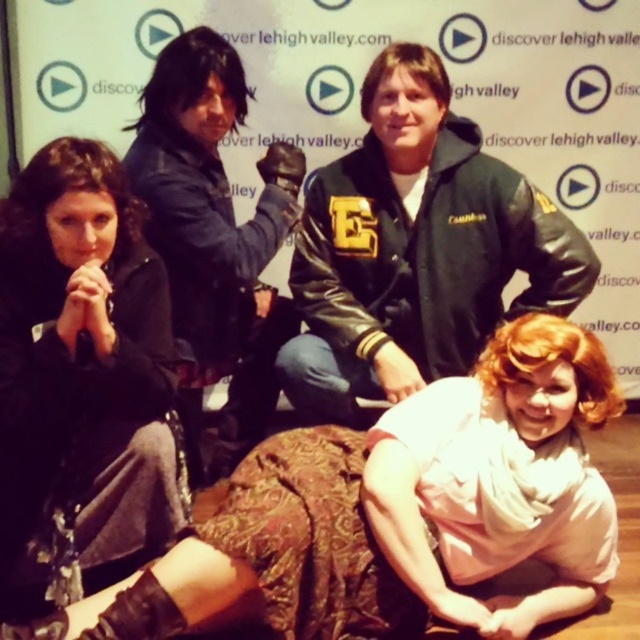
Consider the image. You are taking a photo of the group in front of the backdrop. You want to focus on the person standing at point (480, 369) and the seated person at point (99, 214). Which of these two points is closer to the camera?

Point (480, 369) is further to the camera than point (99, 214). Therefore, the seated person at point (99, 214) is closer to the camera.

You are standing in front of the group photo and need to locate the light pink fabric at lower right. According to the coordinates given, where exactly is it positioned?

The light pink fabric at lower right is positioned at point 0.800 on the x axis and 0.630 on the y axis.